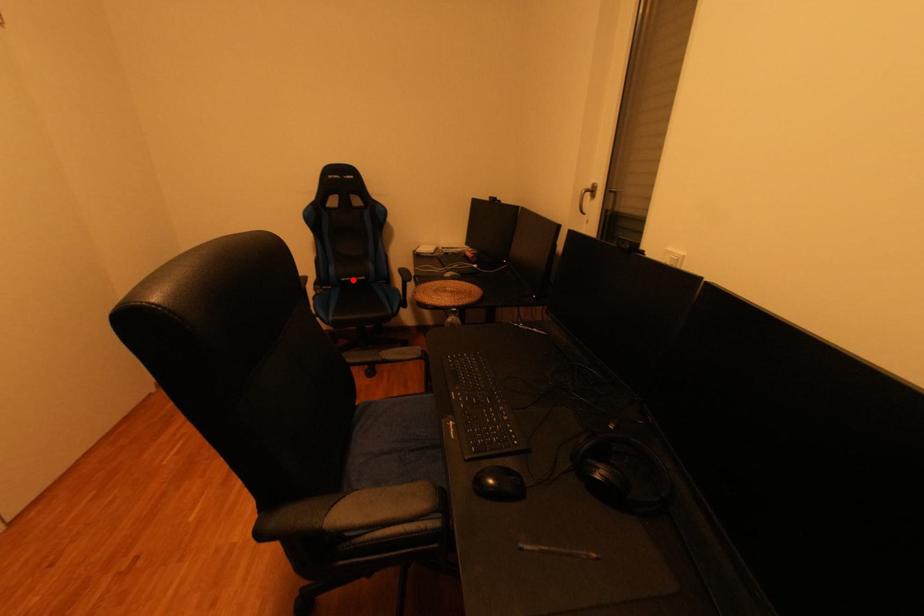
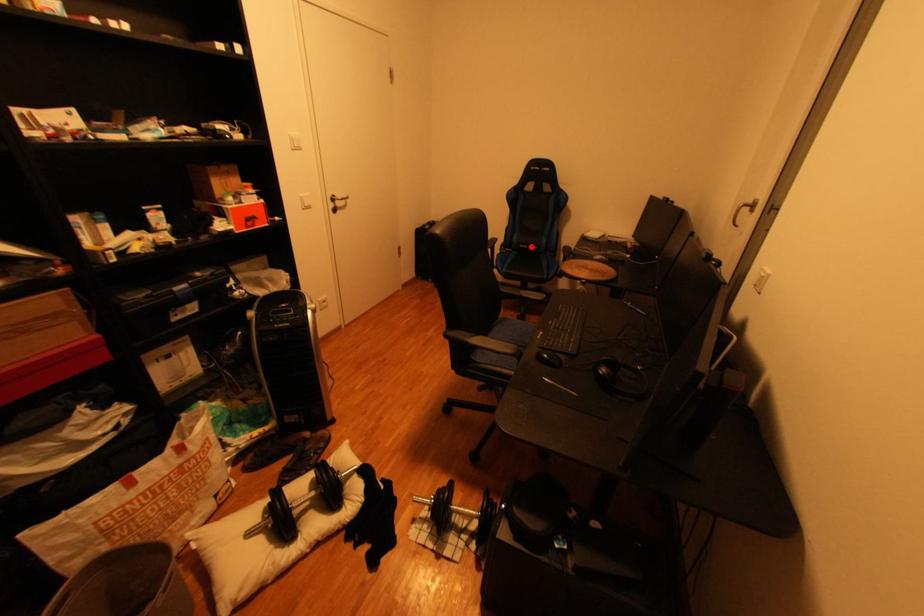
I am providing you with two images of the same scene from different viewpoints. A red point is marked on the first image and another point is marked on the second image. Are the points marked in image1 and image2 representing the same 3D position?

Yes